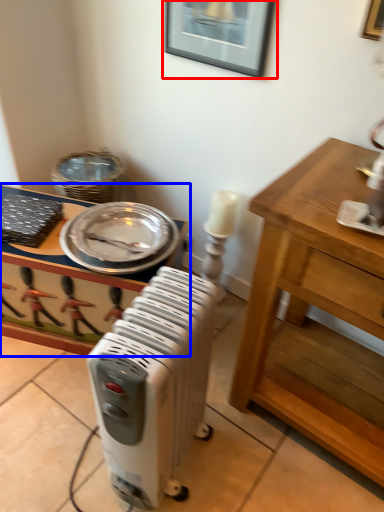
Question: Which object appears farthest to the camera in this image, picture frame (highlighted by a red box) or desk (highlighted by a blue box)?

Choices:
 (A) picture frame
 (B) desk

Answer: (B)